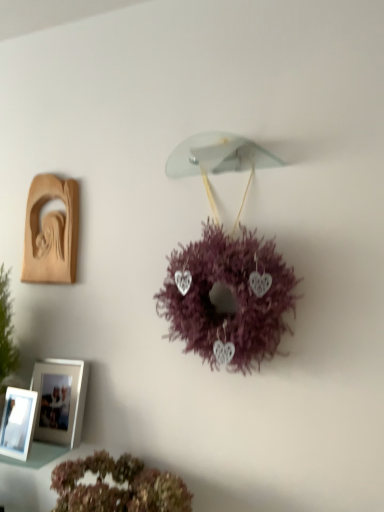
This screenshot has width=384, height=512. What do you see at coordinates (117, 488) in the screenshot? I see `fluffy pink wreath at lower center, the 1th flower from the bottom` at bounding box center [117, 488].

Locate an element on the screen. white glossy picture frame at lower left, the 1th picture frame when ordered from bottom to top is located at coordinates (18, 423).

At what (x,y) coordinates should I click in order to perform the action: click on white glossy picture frame at lower left, which is counted as the second picture frame, starting from the bottom. Please return your answer as a coordinate pair (x, y). The height and width of the screenshot is (512, 384). Looking at the image, I should click on (60, 400).

Locate an element on the screen. fluffy pink wreath at lower center, which ranks as the second flower in top-to-bottom order is located at coordinates (117, 488).

Which of these two, wooden carving at left, which ranks as the first picture frame in top-to-bottom order, or white glossy picture frame at lower left, arranged as the 2th picture frame when viewed from the top, is bigger?

With larger size is white glossy picture frame at lower left, arranged as the 2th picture frame when viewed from the top.

From the picture: Which object is more forward, wooden carving at left, which appears as the third picture frame when ordered from the bottom, or white glossy picture frame at lower left, which is counted as the second picture frame, starting from the bottom?

white glossy picture frame at lower left, which is counted as the second picture frame, starting from the bottom, is in front.

From a real-world perspective, which object stands above the other?

From a 3D spatial view, wooden carving at left, which appears as the third picture frame when ordered from the bottom, is above.

Based on the photo, which is nearer, (56, 234) or (45, 369)?

The point (45, 369) is more forward.

Is fluffy pink wreath at lower center, the 1th flower from the bottom, not near white glossy picture frame at lower left, arranged as the 2th picture frame when viewed from the top?

No, fluffy pink wreath at lower center, the 1th flower from the bottom, is in close proximity to white glossy picture frame at lower left, arranged as the 2th picture frame when viewed from the top.

Which is behind, point (156, 499) or point (81, 430)?

The point (81, 430) is behind.

Is fluffy pink wreath at lower center, which ranks as the second flower in top-to-bottom order, positioned with its back to white glossy picture frame at lower left, which is counted as the second picture frame, starting from the bottom?

fluffy pink wreath at lower center, which ranks as the second flower in top-to-bottom order, does not have its back to white glossy picture frame at lower left, which is counted as the second picture frame, starting from the bottom.

From their relative heights in the image, would you say fluffy pink wreath at lower center, which ranks as the second flower in top-to-bottom order, is taller or shorter than white glossy picture frame at lower left, arranged as the 2th picture frame when viewed from the top?

In the image, fluffy pink wreath at lower center, which ranks as the second flower in top-to-bottom order, appears to be shorter than white glossy picture frame at lower left, arranged as the 2th picture frame when viewed from the top.

Between point (156, 478) and point (18, 408), which one is positioned behind?

The point (18, 408) is farther.

Can you confirm if fluffy pink wreath at lower center, which ranks as the second flower in top-to-bottom order, is positioned to the right of white glossy picture frame at lower left, the third picture frame when ordered from top to bottom?

Yes, fluffy pink wreath at lower center, which ranks as the second flower in top-to-bottom order, is to the right of white glossy picture frame at lower left, the third picture frame when ordered from top to bottom.

Considering the sizes of objects fluffy pink wreath at lower center, the 1th flower from the bottom, and white glossy picture frame at lower left, the third picture frame when ordered from top to bottom, in the image provided, who is thinner, fluffy pink wreath at lower center, the 1th flower from the bottom, or white glossy picture frame at lower left, the third picture frame when ordered from top to bottom,?

white glossy picture frame at lower left, the third picture frame when ordered from top to bottom, is thinner.

Can we say fluffy pink wreath at lower center, which ranks as the second flower in top-to-bottom order, lies outside white glossy picture frame at lower left, the third picture frame when ordered from top to bottom?

Yes.

Could you tell me if purple fluffy wreath at center, the 1th flower in the top-to-bottom sequence, is turned towards white glossy picture frame at lower left, which is counted as the second picture frame, starting from the bottom?

No.

Is purple fluffy wreath at center, the second flower positioned from the bottom, surrounding white glossy picture frame at lower left, which is counted as the second picture frame, starting from the bottom?

That's incorrect, white glossy picture frame at lower left, which is counted as the second picture frame, starting from the bottom, is not inside purple fluffy wreath at center, the second flower positioned from the bottom.

Which object is thinner, purple fluffy wreath at center, the second flower positioned from the bottom, or white glossy picture frame at lower left, arranged as the 2th picture frame when viewed from the top?

With smaller width is white glossy picture frame at lower left, arranged as the 2th picture frame when viewed from the top.

Which object is more forward, purple fluffy wreath at center, the 1th flower in the top-to-bottom sequence, or white glossy picture frame at lower left, which is counted as the second picture frame, starting from the bottom?

Positioned in front is purple fluffy wreath at center, the 1th flower in the top-to-bottom sequence.

Relative to purple fluffy wreath at center, the 1th flower in the top-to-bottom sequence, is wooden carving at left, which appears as the third picture frame when ordered from the bottom, in front or behind?

wooden carving at left, which appears as the third picture frame when ordered from the bottom, is positioned farther from the viewer than purple fluffy wreath at center, the 1th flower in the top-to-bottom sequence.

Find the location of a particular element. The height and width of the screenshot is (512, 384). the 1st flower located beneath the wooden carving at left, which appears as the third picture frame when ordered from the bottom (from a real-world perspective) is located at coordinates (234, 295).

Is wooden carving at left, which appears as the third picture frame when ordered from the bottom, not close to purple fluffy wreath at center, the 1th flower in the top-to-bottom sequence?

No, wooden carving at left, which appears as the third picture frame when ordered from the bottom, is not far from purple fluffy wreath at center, the 1th flower in the top-to-bottom sequence.

Is purple fluffy wreath at center, the second flower positioned from the bottom, a part of wooden carving at left, which ranks as the first picture frame in top-to-bottom order?

No, purple fluffy wreath at center, the second flower positioned from the bottom, is not surrounded by wooden carving at left, which ranks as the first picture frame in top-to-bottom order.

From the image's perspective, is purple fluffy wreath at center, the 1th flower in the top-to-bottom sequence, under fluffy pink wreath at lower center, the 1th flower from the bottom?

No, from the image's perspective, purple fluffy wreath at center, the 1th flower in the top-to-bottom sequence, is not below fluffy pink wreath at lower center, the 1th flower from the bottom.

In terms of width, does purple fluffy wreath at center, the second flower positioned from the bottom, look wider or thinner when compared to fluffy pink wreath at lower center, the 1th flower from the bottom?

purple fluffy wreath at center, the second flower positioned from the bottom, is thinner than fluffy pink wreath at lower center, the 1th flower from the bottom.

Does purple fluffy wreath at center, the 1th flower in the top-to-bottom sequence, contain fluffy pink wreath at lower center, the 1th flower from the bottom?

No, fluffy pink wreath at lower center, the 1th flower from the bottom, is not a part of purple fluffy wreath at center, the 1th flower in the top-to-bottom sequence.

Is purple fluffy wreath at center, the 1th flower in the top-to-bottom sequence, completely or partially outside of wooden carving at left, which appears as the third picture frame when ordered from the bottom?

purple fluffy wreath at center, the 1th flower in the top-to-bottom sequence, is positioned outside wooden carving at left, which appears as the third picture frame when ordered from the bottom.

From the picture: Is purple fluffy wreath at center, the second flower positioned from the bottom, closer to the viewer compared to wooden carving at left, which ranks as the first picture frame in top-to-bottom order?

Yes, purple fluffy wreath at center, the second flower positioned from the bottom, is in front of wooden carving at left, which ranks as the first picture frame in top-to-bottom order.

Between purple fluffy wreath at center, the 1th flower in the top-to-bottom sequence, and wooden carving at left, which appears as the third picture frame when ordered from the bottom, which one has smaller size?

Smaller between the two is wooden carving at left, which appears as the third picture frame when ordered from the bottom.

From a real-world perspective, is purple fluffy wreath at center, the second flower positioned from the bottom, positioned above or below wooden carving at left, which ranks as the first picture frame in top-to-bottom order?

In terms of real-world spatial position, purple fluffy wreath at center, the second flower positioned from the bottom, is below wooden carving at left, which ranks as the first picture frame in top-to-bottom order.

Where is `picture frame on the right of wooden carving at left, which ranks as the first picture frame in top-to-bottom order`? picture frame on the right of wooden carving at left, which ranks as the first picture frame in top-to-bottom order is located at coordinates (60, 400).

From the fluffy pink wreath at lower center, which ranks as the second flower in top-to-bottom order, count the 1st picture frame to the left and point to it. Please provide its 2D coordinates.

[(60, 400)]

Considering their positions, is white glossy picture frame at lower left, which is counted as the second picture frame, starting from the bottom, positioned closer to fluffy pink wreath at lower center, the 1th flower from the bottom, than wooden carving at left, which appears as the third picture frame when ordered from the bottom?

white glossy picture frame at lower left, which is counted as the second picture frame, starting from the bottom.

Considering their positions, is white glossy picture frame at lower left, which is counted as the second picture frame, starting from the bottom, positioned further to fluffy pink wreath at lower center, the 1th flower from the bottom, than white glossy picture frame at lower left, the 1th picture frame when ordered from bottom to top?

The object further to fluffy pink wreath at lower center, the 1th flower from the bottom, is white glossy picture frame at lower left, the 1th picture frame when ordered from bottom to top.

Consider the image. From the image, which object appears to be farther from purple fluffy wreath at center, the second flower positioned from the bottom, white glossy picture frame at lower left, the 1th picture frame when ordered from bottom to top, or white glossy picture frame at lower left, which is counted as the second picture frame, starting from the bottom?

white glossy picture frame at lower left, the 1th picture frame when ordered from bottom to top, is further to purple fluffy wreath at center, the second flower positioned from the bottom.

Which object lies further to the anchor point white glossy picture frame at lower left, the 1th picture frame when ordered from bottom to top, wooden carving at left, which appears as the third picture frame when ordered from the bottom, or fluffy pink wreath at lower center, the 1th flower from the bottom?

Based on the image, wooden carving at left, which appears as the third picture frame when ordered from the bottom, appears to be further to white glossy picture frame at lower left, the 1th picture frame when ordered from bottom to top.

From the image, which object appears to be nearer to fluffy pink wreath at lower center, which ranks as the second flower in top-to-bottom order, white glossy picture frame at lower left, arranged as the 2th picture frame when viewed from the top, or purple fluffy wreath at center, the second flower positioned from the bottom?

Among the two, white glossy picture frame at lower left, arranged as the 2th picture frame when viewed from the top, is located nearer to fluffy pink wreath at lower center, which ranks as the second flower in top-to-bottom order.

Estimate the real-world distances between objects in this image. Which object is further from white glossy picture frame at lower left, arranged as the 2th picture frame when viewed from the top, purple fluffy wreath at center, the second flower positioned from the bottom, or wooden carving at left, which appears as the third picture frame when ordered from the bottom?

purple fluffy wreath at center, the second flower positioned from the bottom.

Looking at this image, from the image, which object appears to be farther from purple fluffy wreath at center, the second flower positioned from the bottom, fluffy pink wreath at lower center, the 1th flower from the bottom, or white glossy picture frame at lower left, the third picture frame when ordered from top to bottom?

Based on the image, white glossy picture frame at lower left, the third picture frame when ordered from top to bottom, appears to be further to purple fluffy wreath at center, the second flower positioned from the bottom.

When comparing their distances from white glossy picture frame at lower left, the third picture frame when ordered from top to bottom, does wooden carving at left, which appears as the third picture frame when ordered from the bottom, or purple fluffy wreath at center, the second flower positioned from the bottom, seem further?

The object further to white glossy picture frame at lower left, the third picture frame when ordered from top to bottom, is purple fluffy wreath at center, the second flower positioned from the bottom.

Where is `flower between wooden carving at left, which ranks as the first picture frame in top-to-bottom order, and fluffy pink wreath at lower center, which ranks as the second flower in top-to-bottom order, in the up-down direction`? flower between wooden carving at left, which ranks as the first picture frame in top-to-bottom order, and fluffy pink wreath at lower center, which ranks as the second flower in top-to-bottom order, in the up-down direction is located at coordinates (234, 295).

The width and height of the screenshot is (384, 512). What are the coordinates of `picture frame located between wooden carving at left, which appears as the third picture frame when ordered from the bottom, and purple fluffy wreath at center, the 1th flower in the top-to-bottom sequence, in the left-right direction` in the screenshot? It's located at (60, 400).

At what (x,y) coordinates should I click in order to perform the action: click on picture frame between wooden carving at left, which ranks as the first picture frame in top-to-bottom order, and white glossy picture frame at lower left, the 1th picture frame when ordered from bottom to top, in the vertical direction. Please return your answer as a coordinate pair (x, y). Looking at the image, I should click on (60, 400).

I want to click on picture frame between fluffy pink wreath at lower center, the 1th flower from the bottom, and white glossy picture frame at lower left, which is counted as the second picture frame, starting from the bottom, from front to back, so click(x=18, y=423).